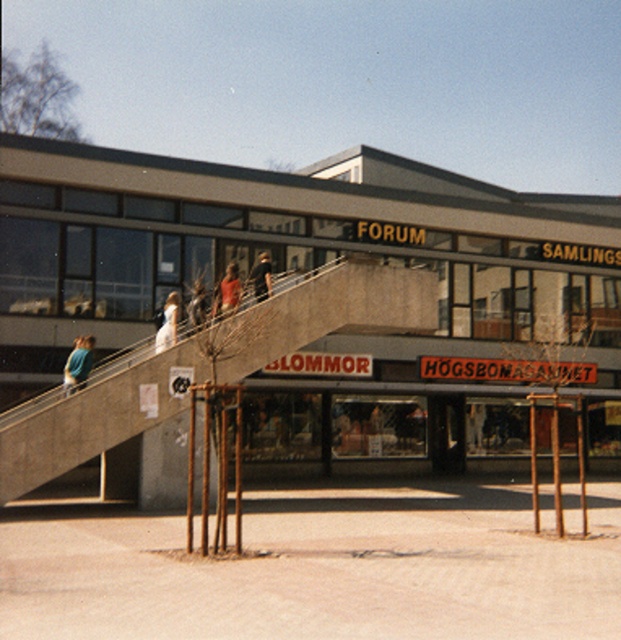
Between blue fabric shirt at lower left and orange fabric shirt at upper center, which one is positioned higher?

orange fabric shirt at upper center is above.

Between blue fabric shirt at lower left and orange fabric shirt at upper center, which one has more height?

With more height is blue fabric shirt at lower left.

What do you see at coordinates (78, 364) in the screenshot? The image size is (621, 640). I see `blue fabric shirt at lower left` at bounding box center [78, 364].

Locate an element on the screen. blue fabric shirt at lower left is located at coordinates (78, 364).

Is concrete escalator at center closer to camera compared to white dress at upper center?

That is True.

Where is `concrete escalator at center`? concrete escalator at center is located at coordinates pyautogui.click(x=206, y=365).

Image resolution: width=621 pixels, height=640 pixels. What are the coordinates of `concrete escalator at center` in the screenshot? It's located at point(206,365).

Can you confirm if concrete escalator at center is wider than blue fabric shirt at lower left?

Yes.

Can you confirm if concrete escalator at center is bigger than blue fabric shirt at lower left?

Yes, concrete escalator at center is bigger than blue fabric shirt at lower left.

Between point (430, 326) and point (89, 348), which one is positioned behind?

The point (430, 326) is behind.

You are a GUI agent. You are given a task and a screenshot of the screen. Output one action in this format:
    pyautogui.click(x=<x>, y=<y>)
    Task: Click on the concrete escalator at center
    
    Given the screenshot: What is the action you would take?
    pyautogui.click(x=206, y=365)